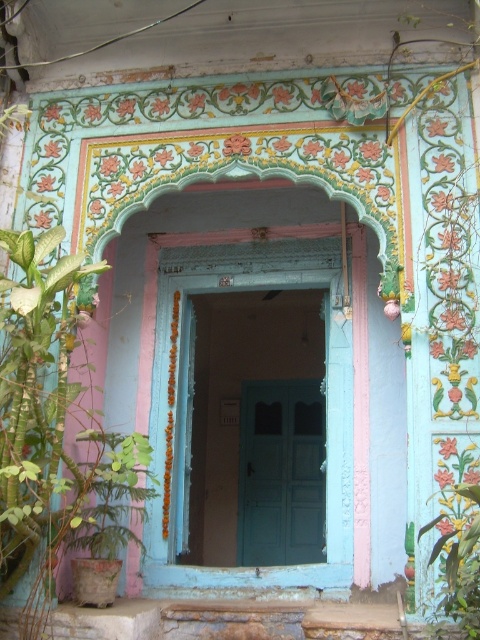
Does green leafy plant at left have a greater height compared to green leafy plant at lower right?

Correct, green leafy plant at left is much taller as green leafy plant at lower right.

Does green leafy plant at left come behind green leafy plant at lower right?

Yes, it is behind green leafy plant at lower right.

Is point (61, 436) behind point (478, 545)?

Yes, point (61, 436) is farther from viewer.

I want to click on green leafy plant at left, so click(x=48, y=426).

Is teal painted door at center positioned behind green leafy plant at lower right?

Yes, teal painted door at center is further from the viewer.

Which is more to the left, teal painted door at center or green leafy plant at lower right?

From the viewer's perspective, teal painted door at center appears more on the left side.

Which is in front, point (330, 291) or point (476, 554)?

Point (476, 554) is more forward.

You are a GUI agent. You are given a task and a screenshot of the screen. Output one action in this format:
    pyautogui.click(x=<x>, y=<y>)
    Task: Click on the teal painted door at center
    
    Given the screenshot: What is the action you would take?
    pyautogui.click(x=266, y=412)

Who is taller, teal painted door at center or teal matte door at center?

With more height is teal painted door at center.

Who is positioned more to the right, teal painted door at center or teal matte door at center?

teal matte door at center is more to the right.

Identify the location of teal painted door at center. The width and height of the screenshot is (480, 640). (266, 412).